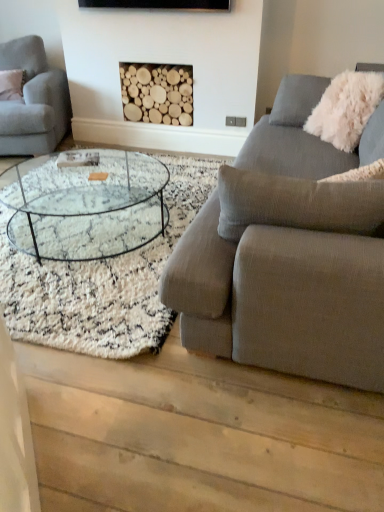
Question: In the image, is clear glass coffee table at center on the left side or the right side of textured gray couch at right, the first studio couch when ordered from front to back?

Choices:
 (A) left
 (B) right

Answer: (A)

Question: Is clear glass coffee table at center spatially inside textured gray couch at right, the first studio couch when ordered from front to back, or outside of it?

Choices:
 (A) outside
 (B) inside

Answer: (A)

Question: Which object is the farthest from the textured gray couch at right, positioned as the second studio couch in back-to-front order?

Choices:
 (A) natural wood logs at center
 (B) light gray fabric couch at left, the 2th studio couch when ordered from front to back
 (C) clear glass coffee table at center
 (D) white fluffy pillow at upper right

Answer: (B)

Question: Which object is positioned farthest from the white fluffy pillow at upper right?

Choices:
 (A) natural wood logs at center
 (B) textured gray couch at right, the first studio couch when ordered from front to back
 (C) light gray fabric couch at left, the 2th studio couch when ordered from front to back
 (D) clear glass coffee table at center

Answer: (C)